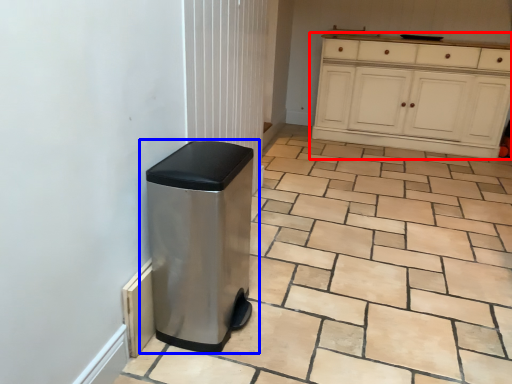
Question: Among these objects, which one is nearest to the camera, cabinetry (highlighted by a red box) or waste container (highlighted by a blue box)?

Choices:
 (A) cabinetry
 (B) waste container

Answer: (B)